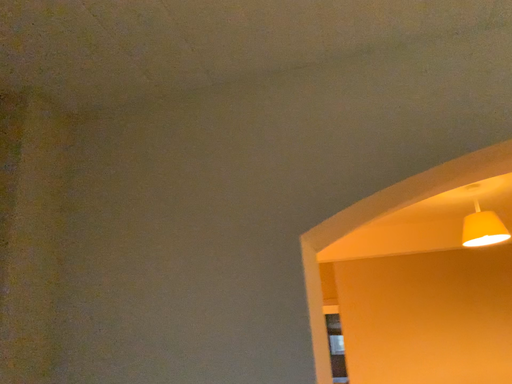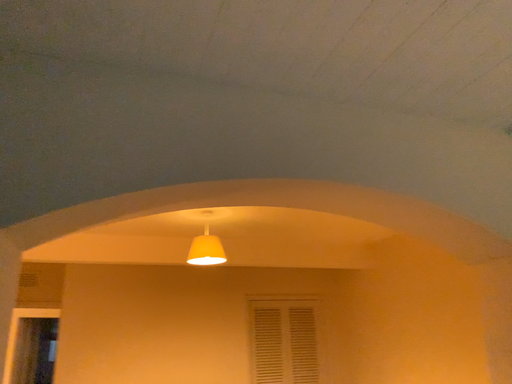
Question: Which way did the camera rotate in the video?

Choices:
 (A) rotated right
 (B) rotated left

Answer: (A)